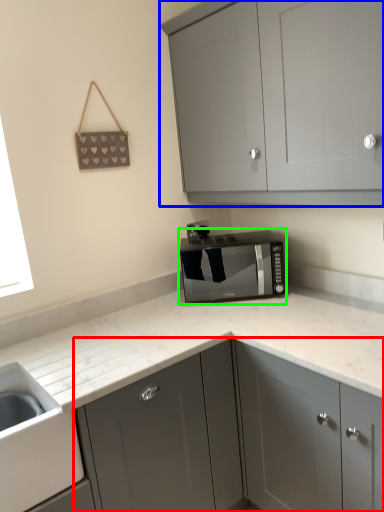
Question: Considering the real-world distances, which object is closest to cabinetry (highlighted by a red box)? cabinetry (highlighted by a blue box) or home appliance (highlighted by a green box).

Choices:
 (A) cabinetry
 (B) home appliance

Answer: (B)